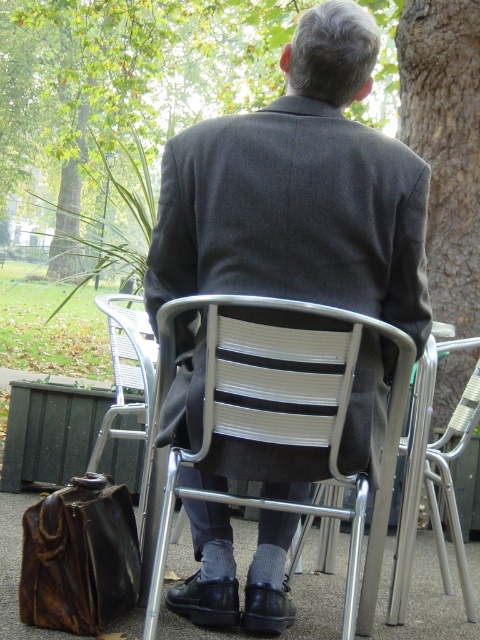
Which is above, dark gray wool jacket at center or silver metallic chair at center?

Positioned higher is dark gray wool jacket at center.

The height and width of the screenshot is (640, 480). What do you see at coordinates (299, 193) in the screenshot?
I see `dark gray wool jacket at center` at bounding box center [299, 193].

The height and width of the screenshot is (640, 480). I want to click on dark gray wool jacket at center, so click(x=299, y=193).

Between metallic silver chair at center and leather briefcase at lower left, which one appears on the left side from the viewer's perspective?

leather briefcase at lower left is more to the left.

Is metallic silver chair at center shorter than leather briefcase at lower left?

In fact, metallic silver chair at center may be taller than leather briefcase at lower left.

You are a GUI agent. You are given a task and a screenshot of the screen. Output one action in this format:
    pyautogui.click(x=<x>, y=<y>)
    Task: Click on the metallic silver chair at center
    
    Given the screenshot: What is the action you would take?
    pyautogui.click(x=283, y=422)

Which is more to the left, dark gray wool jacket at center or leather briefcase at lower left?

leather briefcase at lower left is more to the left.

Is point (218, 147) positioned after point (124, 561)?

No, (218, 147) is closer to viewer.

Where is `dark gray wool jacket at center`? dark gray wool jacket at center is located at coordinates (299, 193).

Image resolution: width=480 pixels, height=640 pixels. In order to click on dark gray wool jacket at center in this screenshot , I will do `click(299, 193)`.